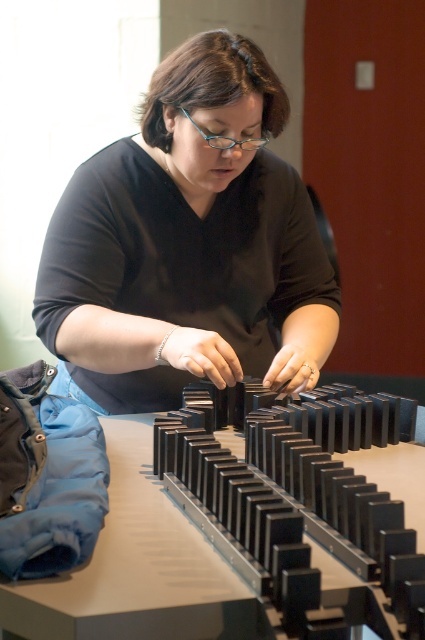
Can you confirm if matte black shirt at center is smaller than black plastic blocks at center?

No.

Is matte black shirt at center above black plastic blocks at center?

Correct, matte black shirt at center is located above black plastic blocks at center.

Image resolution: width=425 pixels, height=640 pixels. In order to click on matte black shirt at center in this screenshot , I will do `click(187, 244)`.

Image resolution: width=425 pixels, height=640 pixels. I want to click on matte black shirt at center, so click(x=187, y=244).